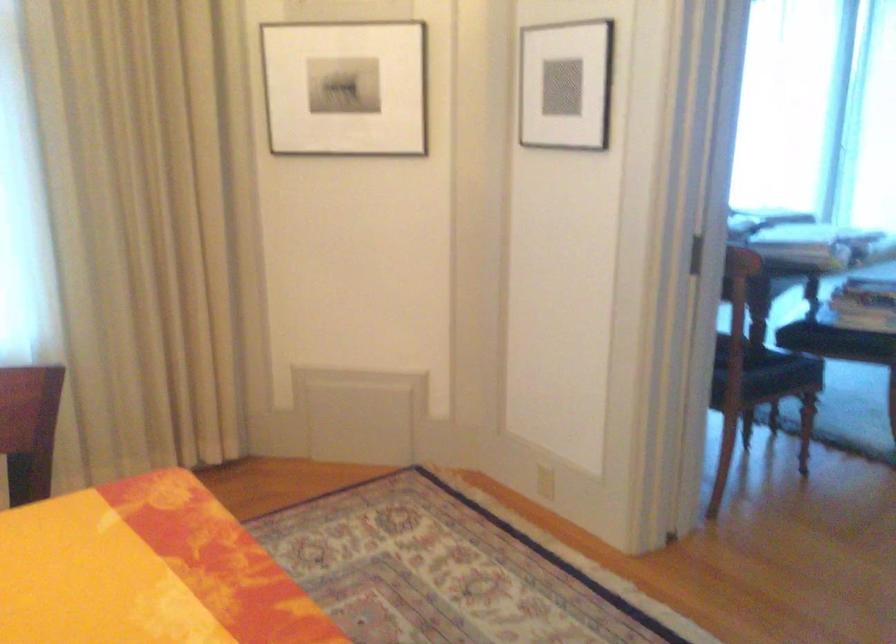
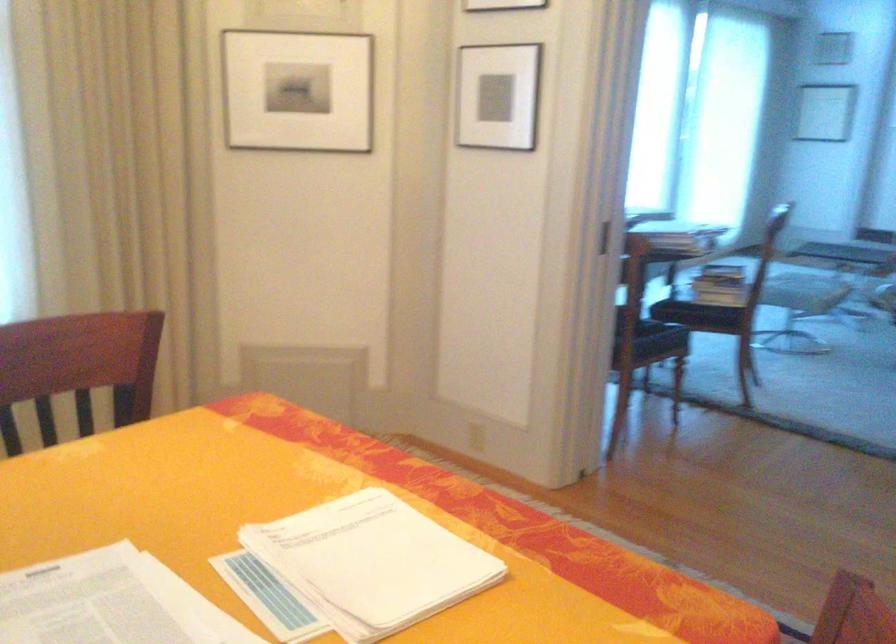
Question: The first image is from the beginning of the video and the second image is from the end. How did the camera likely rotate when shooting the video?

Choices:
 (A) Left
 (B) Right
 (C) Up
 (D) Down

Answer: (B)